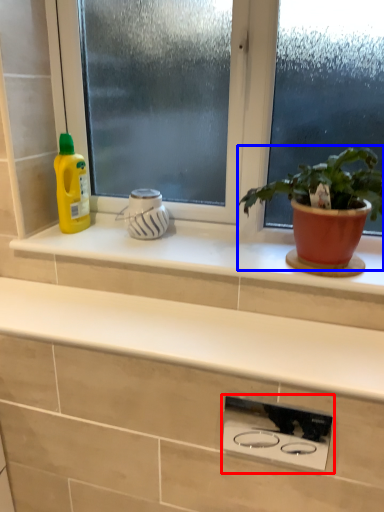
Question: Which object is closer to the camera taking this photo, appliance (highlighted by a red box) or houseplant (highlighted by a blue box)?

Choices:
 (A) appliance
 (B) houseplant

Answer: (B)